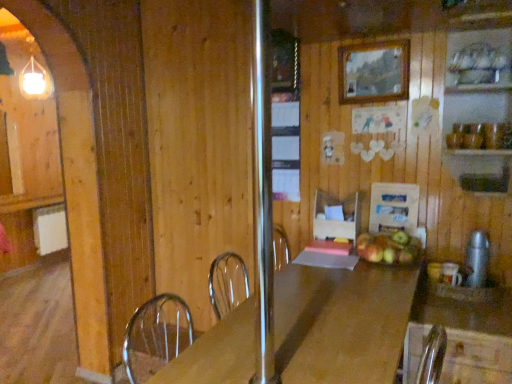
Identify the location of satin silver thermos at right, which is the second appliance from left to right. This screenshot has width=512, height=384. (477, 259).

Locate an element on the screen. The height and width of the screenshot is (384, 512). wooden table at center is located at coordinates (341, 322).

What do you see at coordinates (389, 248) in the screenshot? I see `green matte apples at center` at bounding box center [389, 248].

Where is `wooden cutting board at center, which is counted as the 1th appliance, starting from the left`? This screenshot has width=512, height=384. wooden cutting board at center, which is counted as the 1th appliance, starting from the left is located at coordinates (394, 207).

Is green matte apples at center directly adjacent to wooden picture frame at upper center?

No, green matte apples at center is not beside wooden picture frame at upper center.

Is green matte apples at center looking in the opposite direction of wooden picture frame at upper center?

green matte apples at center does not have its back to wooden picture frame at upper center.

Considering the relative positions of green matte apples at center and wooden picture frame at upper center in the image provided, is green matte apples at center to the left of wooden picture frame at upper center from the viewer's perspective?

Incorrect, green matte apples at center is not on the left side of wooden picture frame at upper center.

Is green matte apples at center completely or partially outside of wooden picture frame at upper center?

Yes.

Considering the sizes of objects wooden picture frame at upper center and green matte apples at center in the image provided, who is taller, wooden picture frame at upper center or green matte apples at center?

wooden picture frame at upper center is taller.

Is wooden picture frame at upper center bigger than green matte apples at center?

No.

In the scene shown: Considering the sizes of wooden picture frame at upper center and green matte apples at center in the image, is wooden picture frame at upper center wider or thinner than green matte apples at center?

In the image, wooden picture frame at upper center appears to be more narrow than green matte apples at center.

Does wooden table at center have a lesser width compared to satin silver thermos at right, positioned as the second appliance in back-to-front order?

No, wooden table at center is not thinner than satin silver thermos at right, positioned as the second appliance in back-to-front order.

This screenshot has height=384, width=512. I want to click on appliance that is the 1st one when counting backward from the wooden table at center, so click(x=477, y=259).

Based on the photo, is wooden table at center positioned far away from satin silver thermos at right, positioned as the second appliance in back-to-front order?

Result: wooden table at center is near satin silver thermos at right, positioned as the second appliance in back-to-front order, not far away.

Is wooden table at center further to camera compared to satin silver thermos at right, positioned as the second appliance in back-to-front order?

No, wooden table at center is closer to the camera.

Is wooden picture frame at upper center to the left of wooden cutting board at center, arranged as the 1th appliance when viewed from the back, from the viewer's perspective?

Yes, wooden picture frame at upper center is to the left of wooden cutting board at center, arranged as the 1th appliance when viewed from the back.

From a real-world perspective, does wooden picture frame at upper center stand above wooden cutting board at center, marked as the 2th appliance in a right-to-left arrangement?

Correct, in the physical world, wooden picture frame at upper center is higher than wooden cutting board at center, marked as the 2th appliance in a right-to-left arrangement.

Considering the sizes of objects wooden picture frame at upper center and wooden cutting board at center, which is counted as the 1th appliance, starting from the left, in the image provided, who is bigger, wooden picture frame at upper center or wooden cutting board at center, which is counted as the 1th appliance, starting from the left,?

wooden cutting board at center, which is counted as the 1th appliance, starting from the left.

In the scene shown: Which of these two, wooden picture frame at upper center or wooden cutting board at center, marked as the 2th appliance in a right-to-left arrangement, stands shorter?

Standing shorter between the two is wooden picture frame at upper center.

From a real-world perspective, is green matte apples at center under wooden table at center?

Incorrect, from a real-world perspective, green matte apples at center is higher than wooden table at center.

Which object is closer to the camera, green matte apples at center or wooden table at center?

Positioned in front is wooden table at center.

Are green matte apples at center and wooden table at center beside each other?

No, green matte apples at center is not touching wooden table at center.

Does green matte apples at center appear on the left side of wooden table at center?

No.

Does wooden table at center come in front of wooden countertop at right?

Yes, wooden table at center is in front of wooden countertop at right.

Can you confirm if wooden table at center is smaller than wooden countertop at right?

Incorrect, wooden table at center is not smaller in size than wooden countertop at right.

Considering the relative sizes of wooden table at center and wooden countertop at right in the image provided, is wooden table at center taller than wooden countertop at right?

Yes, wooden table at center is taller than wooden countertop at right.

Can you confirm if wooden countertop at right is bigger than wooden picture frame at upper center?

Indeed, wooden countertop at right has a larger size compared to wooden picture frame at upper center.

Considering the points (499, 380) and (368, 92), which point is in front, point (499, 380) or point (368, 92)?

The point (499, 380) is more forward.

Would you say wooden countertop at right is outside wooden picture frame at upper center?

Indeed, wooden countertop at right is completely outside wooden picture frame at upper center.

Between wooden countertop at right and wooden picture frame at upper center, which one has larger width?

wooden countertop at right.

Where is `picture frame on the left of green matte apples at center`? The height and width of the screenshot is (384, 512). picture frame on the left of green matte apples at center is located at coordinates (373, 72).

Where is `picture frame behind the green matte apples at center`? picture frame behind the green matte apples at center is located at coordinates (373, 72).

Which object lies nearer to the anchor point wooden table at center, wooden countertop at right or wooden picture frame at upper center?

wooden countertop at right is closer to wooden table at center.

Looking at the image, which one is located further to satin silver thermos at right, which appears as the 1th appliance when viewed from the front, wooden cutting board at center, arranged as the 1th appliance when viewed from the back, or wooden table at center?

wooden table at center.

Considering their positions, is satin silver thermos at right, which is the second appliance from left to right, positioned further to wooden cutting board at center, arranged as the 1th appliance when viewed from the back, than green matte apples at center?

satin silver thermos at right, which is the second appliance from left to right, lies further to wooden cutting board at center, arranged as the 1th appliance when viewed from the back, than the other object.

Based on their spatial positions, is wooden picture frame at upper center or wooden table at center closer to wooden cutting board at center, marked as the 2th appliance in a right-to-left arrangement?

Based on the image, wooden picture frame at upper center appears to be nearer to wooden cutting board at center, marked as the 2th appliance in a right-to-left arrangement.

In the scene shown: Based on their spatial positions, is wooden countertop at right or wooden table at center further from green matte apples at center?

Among the two, wooden table at center is located further to green matte apples at center.

Estimate the real-world distances between objects in this image. Which object is further from wooden picture frame at upper center, green matte apples at center or wooden countertop at right?

wooden countertop at right is positioned further to the anchor wooden picture frame at upper center.

Estimate the real-world distances between objects in this image. Which object is further from wooden countertop at right, wooden table at center or satin silver thermos at right, the first appliance from the right?

The object further to wooden countertop at right is wooden table at center.

Considering their positions, is wooden table at center positioned closer to wooden picture frame at upper center than green matte apples at center?

green matte apples at center.

You are a GUI agent. You are given a task and a screenshot of the screen. Output one action in this format:
    pyautogui.click(x=<x>, y=<y>)
    Task: Click on the apple between wooden table at center and wooden cutting board at center, which ranks as the 2th appliance in front-to-back order, in the front-back direction
    This screenshot has height=384, width=512.
    Given the screenshot: What is the action you would take?
    pyautogui.click(x=389, y=248)

Locate an element on the screen. appliance between wooden cutting board at center, which is counted as the 1th appliance, starting from the left, and wooden countertop at right vertically is located at coordinates (477, 259).

This screenshot has width=512, height=384. In order to click on apple that lies between wooden cutting board at center, which ranks as the 2th appliance in front-to-back order, and wooden countertop at right from top to bottom in this screenshot , I will do `click(389, 248)`.

Where is `apple between wooden picture frame at upper center and wooden countertop at right in the up-down direction`? The image size is (512, 384). apple between wooden picture frame at upper center and wooden countertop at right in the up-down direction is located at coordinates (389, 248).